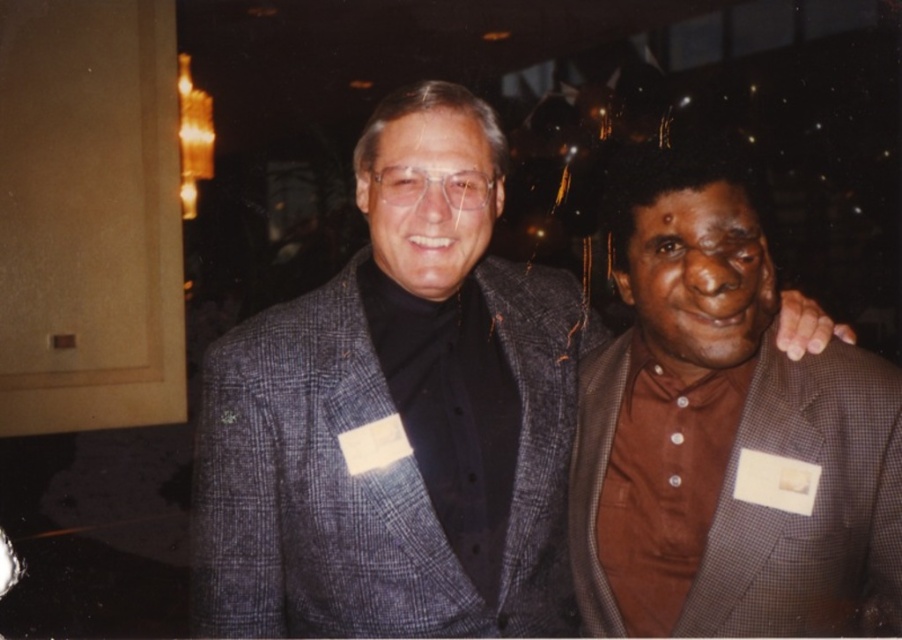
Question: Is plaid wool blazer at center wider than brown matte shirt at right?

Choices:
 (A) no
 (B) yes

Answer: (B)

Question: Which of the following is the closest to the observer?

Choices:
 (A) (669, 378)
 (B) (384, 100)

Answer: (A)

Question: Does plaid wool blazer at center have a smaller size compared to brown matte shirt at right?

Choices:
 (A) yes
 (B) no

Answer: (B)

Question: Is plaid wool blazer at center below brown matte shirt at right?

Choices:
 (A) yes
 (B) no

Answer: (B)

Question: Which point is farther from the camera taking this photo?

Choices:
 (A) (743, 237)
 (B) (264, 376)

Answer: (B)